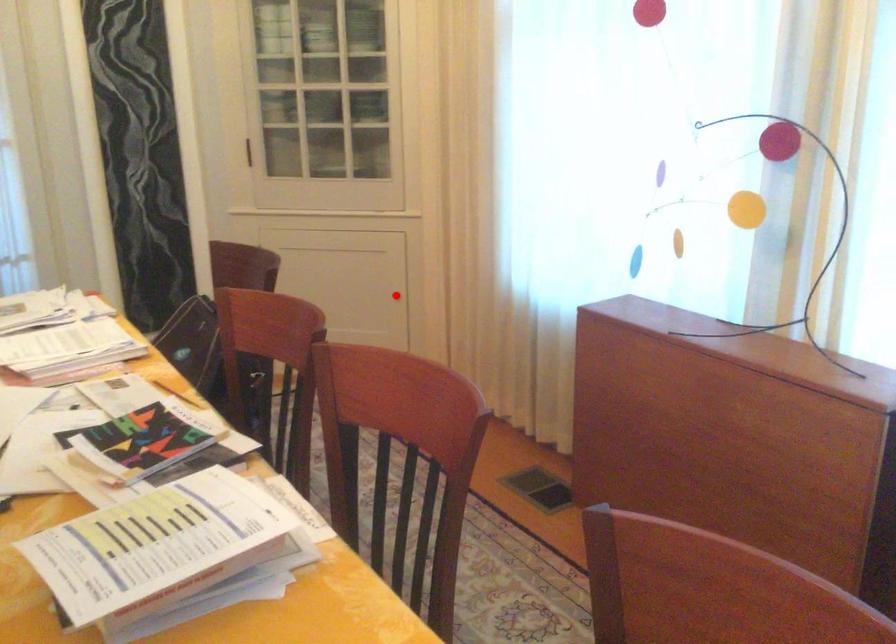
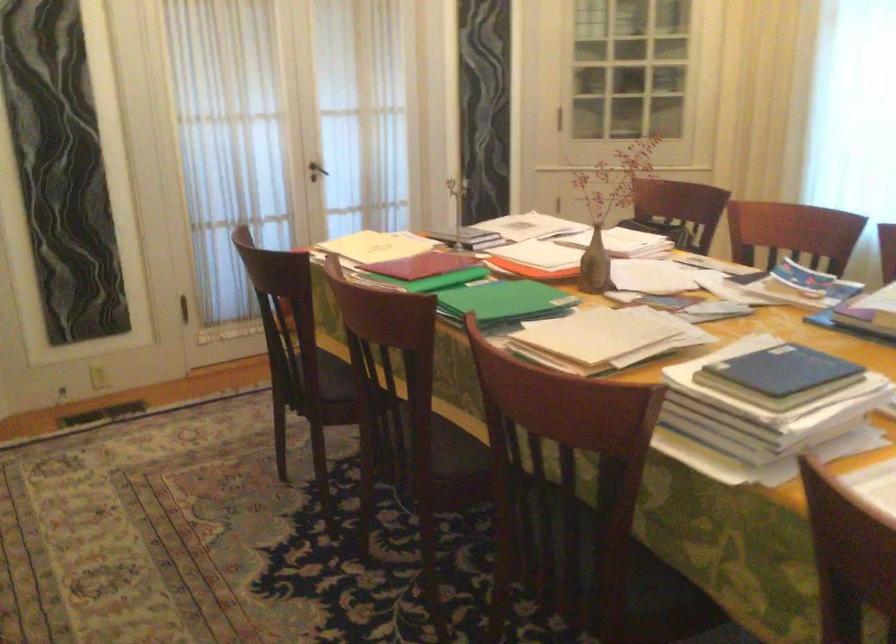
Question: I am providing you with two images of the same scene from different viewpoints. A red point is marked on the first image. Is the red point's position out of view in image 2?

Choices:
 (A) Yes
 (B) No

Answer: (A)